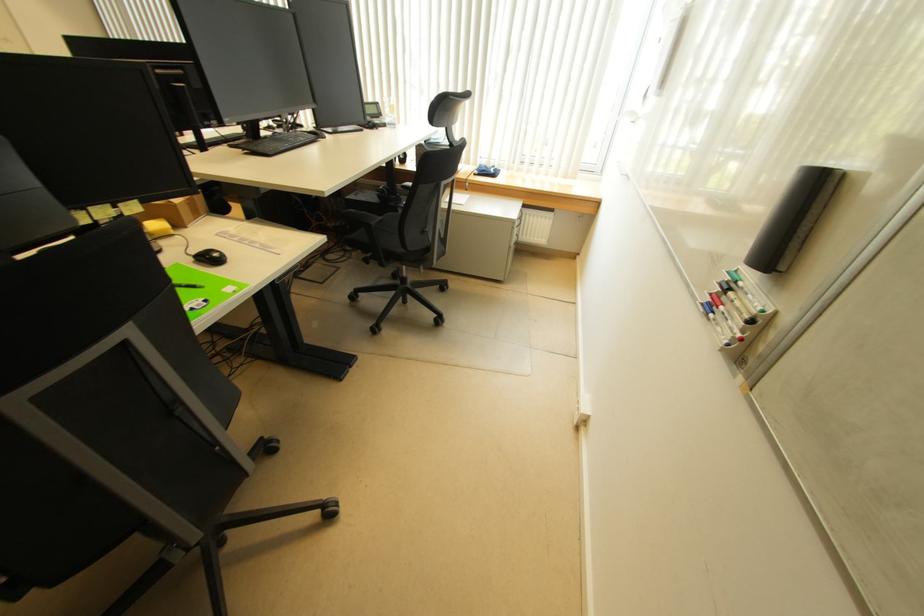
Where is `chair sitting surface`? Image resolution: width=924 pixels, height=616 pixels. chair sitting surface is located at coordinates (404, 228).